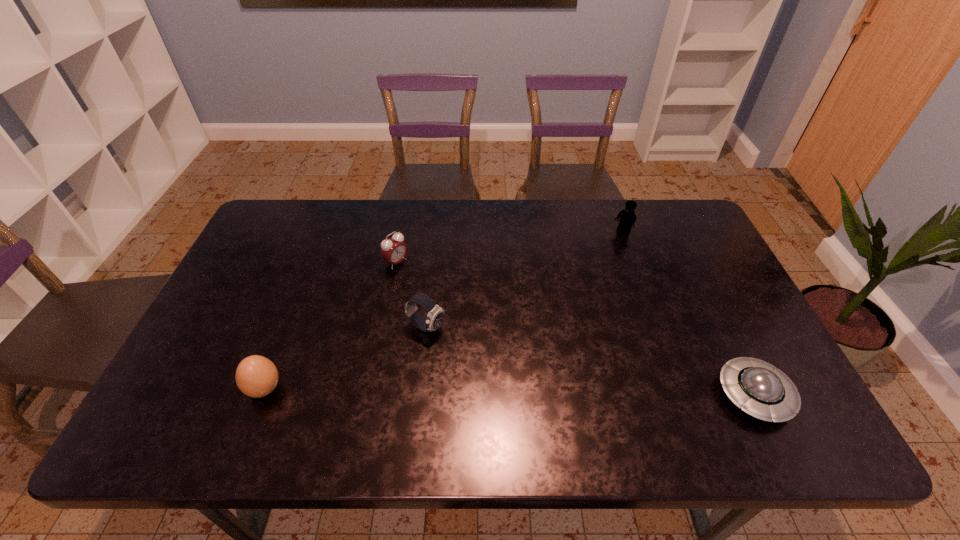
Where is `object located in the far edge section of the desktop`? object located in the far edge section of the desktop is located at coordinates (627, 217).

Locate an element on the screen. The height and width of the screenshot is (540, 960). boiled egg present at the near edge is located at coordinates (256, 376).

Find the location of `saucer located at the near edge`. saucer located at the near edge is located at coordinates (762, 391).

Where is `object that is at the right edge`? object that is at the right edge is located at coordinates (762, 391).

This screenshot has height=540, width=960. Find the location of `object that is at the near right corner`. object that is at the near right corner is located at coordinates (762, 391).

In the image, there is a desktop. Identify the location of vacant space at the far edge. Image resolution: width=960 pixels, height=540 pixels. (526, 204).

The image size is (960, 540). Find the location of `vacant space at the near edge`. vacant space at the near edge is located at coordinates (666, 386).

This screenshot has height=540, width=960. Find the location of `vacant space at the left edge of the desktop`. vacant space at the left edge of the desktop is located at coordinates (242, 300).

In the image, there is a desktop. Identify the location of vacant space at the right edge. (764, 359).

The image size is (960, 540). What are the coordinates of `vacant space at the far left corner` in the screenshot? It's located at (266, 220).